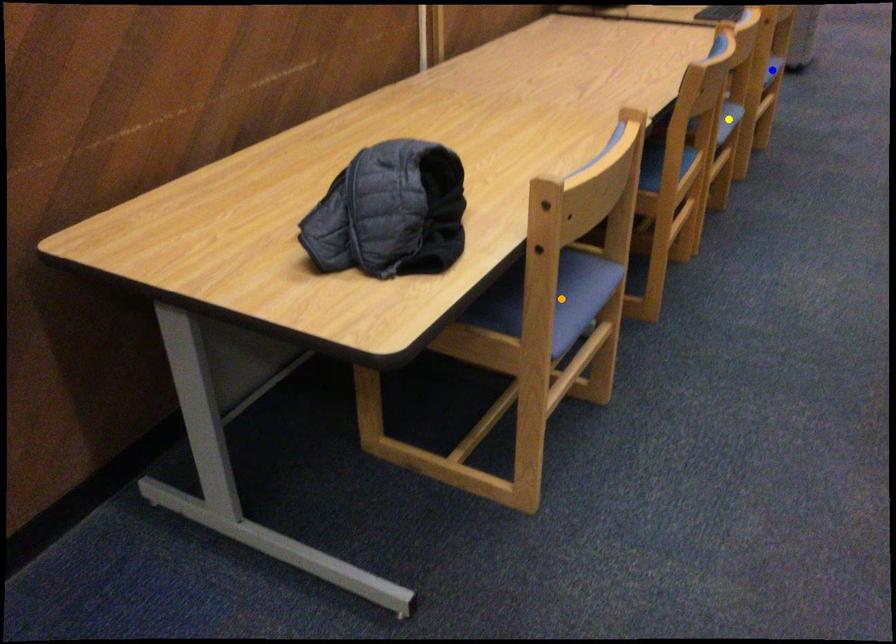
Order these from nearest to farthest:
1. yellow point
2. blue point
3. orange point

orange point < yellow point < blue point